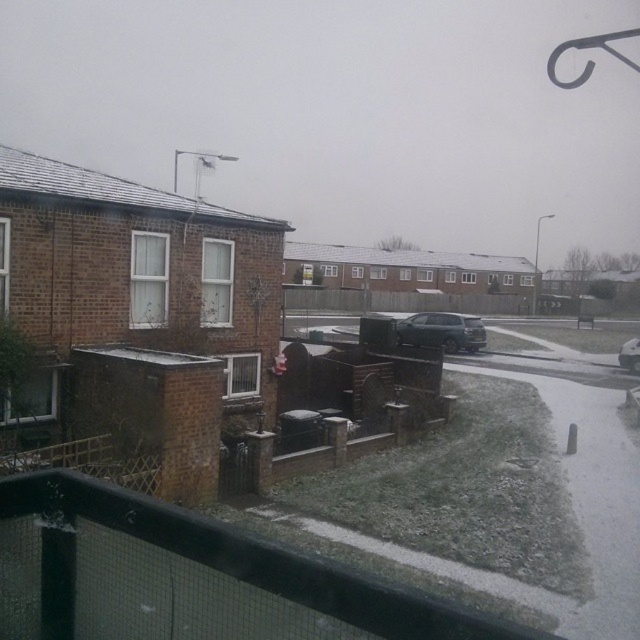
You are a delivery driver who needs to park your vehicle between the satin black car at center and the white glossy car at center. Is there enough space between them to fit your 2.5 meter wide delivery van?

The satin black car at center is positioned on the left side of the white glossy car at center, but the distance between them isn not specified. Without knowing the exact spacing, it is impossible to determine if the 2.5 meter wide delivery van can fit between them.

You are standing on a balcony overlooking a residential street. You notice a specific point marked at coordinates (420,337) in the scene. If you were to throw a small snowball from your position, would it reach that point? Assume the snowball can travel up to 30 meters.

The distance of point (420,337) from viewer is 31.37 meters, which is beyond the snowball travel distance of 30 meters. Therefore, the snowball would not reach the point.

You are a delivery driver who needs to park your vehicle in the residential area shown in the image. You have two cars available for the job, a larger one and a smaller one. The scene shows a satin black car at center and a white glossy car at center. Which car should you choose to ensure it fits in the available parking space without taking up too much space?

The satin black car at center is bigger than the white glossy car at center. Therefore, you should choose the white glossy car at center since it is smaller and will fit better in the available parking space without taking up too much space.